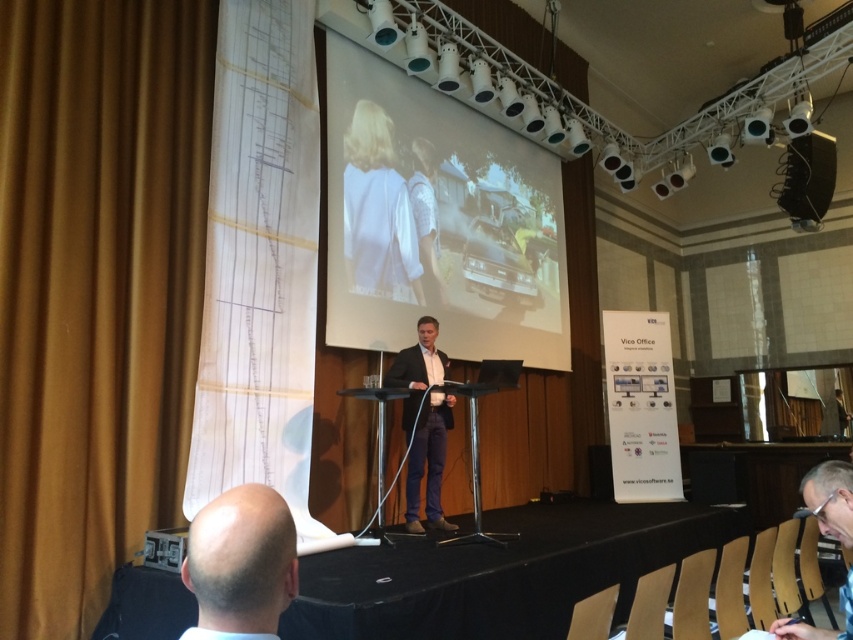
Can you confirm if white glossy projection screen at center is positioned below black matte speaker at upper right?

Correct, white glossy projection screen at center is located below black matte speaker at upper right.

Does white glossy projection screen at center have a larger size compared to black matte speaker at upper right?

Indeed, white glossy projection screen at center has a larger size compared to black matte speaker at upper right.

Where is `white glossy projection screen at center`? This screenshot has height=640, width=853. white glossy projection screen at center is located at coordinates [x=437, y=220].

Can you confirm if bald head at lower left is positioned above clear plastic glasses at lower right?

Yes.

Can you confirm if bald head at lower left is smaller than clear plastic glasses at lower right?

Correct, bald head at lower left occupies less space than clear plastic glasses at lower right.

Locate an element on the screen. This screenshot has height=640, width=853. bald head at lower left is located at coordinates (241, 564).

The image size is (853, 640). Identify the location of bald head at lower left. coord(241,564).

Which is below, clear plastic glasses at lower right or black matte speaker at upper right?

Positioned lower is clear plastic glasses at lower right.

Is the position of clear plastic glasses at lower right less distant than that of black matte speaker at upper right?

Yes, clear plastic glasses at lower right is in front of black matte speaker at upper right.

Does point (787, 627) come farther from viewer compared to point (802, 200)?

That is False.

Find the location of `clear plastic glasses at lower right`. clear plastic glasses at lower right is located at coordinates (830, 499).